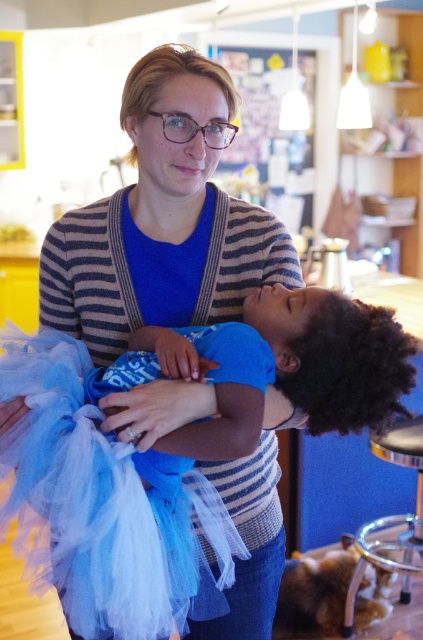
Who is positioned more to the right, striped sweater at center or blue tulle dress at center?

blue tulle dress at center

Does striped sweater at center have a larger size compared to blue tulle dress at center?

Indeed, striped sweater at center has a larger size compared to blue tulle dress at center.

The width and height of the screenshot is (423, 640). I want to click on striped sweater at center, so click(x=162, y=220).

Locate an element on the screen. striped sweater at center is located at coordinates (162, 220).

Does striped sweater at center have a larger size compared to metallic silver stool at lower right?

No, striped sweater at center is not bigger than metallic silver stool at lower right.

Consider the image. Which is more to the left, striped sweater at center or metallic silver stool at lower right?

From the viewer's perspective, striped sweater at center appears more on the left side.

Is point (77, 275) more distant than point (367, 545)?

No, it is in front of (367, 545).

I want to click on striped sweater at center, so click(162, 220).

Between blue tulle dress at center and metallic silver stool at lower right, which one appears on the left side from the viewer's perspective?

blue tulle dress at center is more to the left.

Is point (340, 362) farther from camera compared to point (406, 438)?

No, (340, 362) is in front of (406, 438).

You are a GUI agent. You are given a task and a screenshot of the screen. Output one action in this format:
    pyautogui.click(x=<x>, y=<y>)
    Task: Click on the blue tulle dress at center
    The height and width of the screenshot is (640, 423).
    Given the screenshot: What is the action you would take?
    pyautogui.click(x=329, y=360)